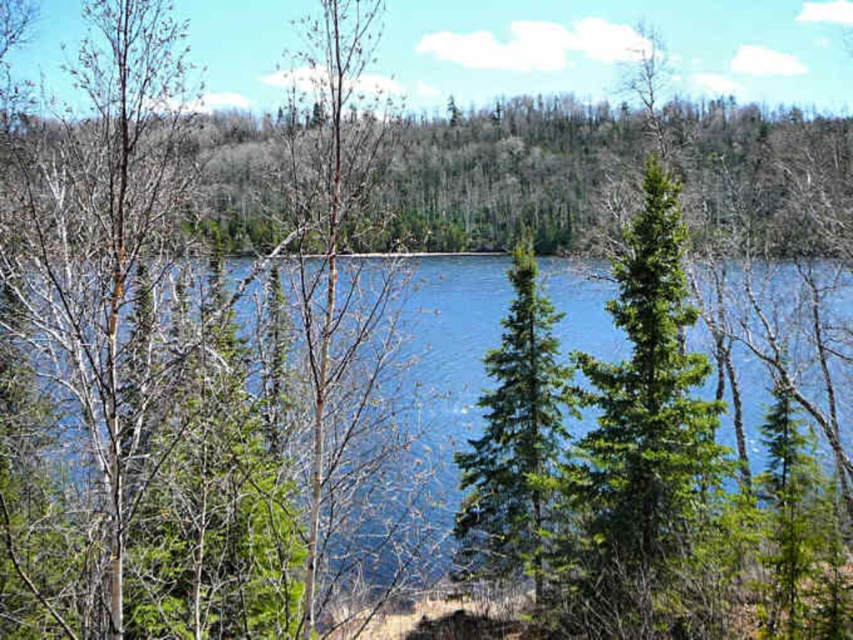
Question: Among these points, which one is farthest from the camera?

Choices:
 (A) (62, 419)
 (B) (520, 269)

Answer: (B)

Question: Which of the following is the closest to the observer?

Choices:
 (A) (405, 420)
 (B) (512, 396)

Answer: (A)

Question: Does blue liquid water at center appear over green needle-like tree at center?

Choices:
 (A) no
 (B) yes

Answer: (B)

Question: In this image, where is blue liquid water at center located relative to green needle-like tree at center?

Choices:
 (A) above
 (B) below

Answer: (A)

Question: Which of the following is the closest to the observer?

Choices:
 (A) blue liquid water at center
 (B) green needle-like tree at center

Answer: (A)

Question: Does blue liquid water at center appear on the right side of green needle-like tree at center?

Choices:
 (A) no
 (B) yes

Answer: (B)